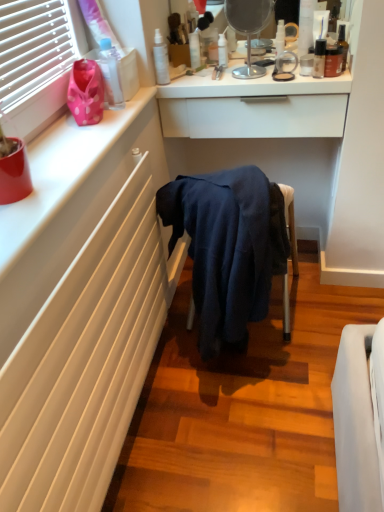
This screenshot has width=384, height=512. I want to click on free area in between satin white spray bottle at upper center, the 2th toiletry from the left, and matte brown bottle at upper right, the seventh toiletry in the left-to-right sequence, so click(229, 80).